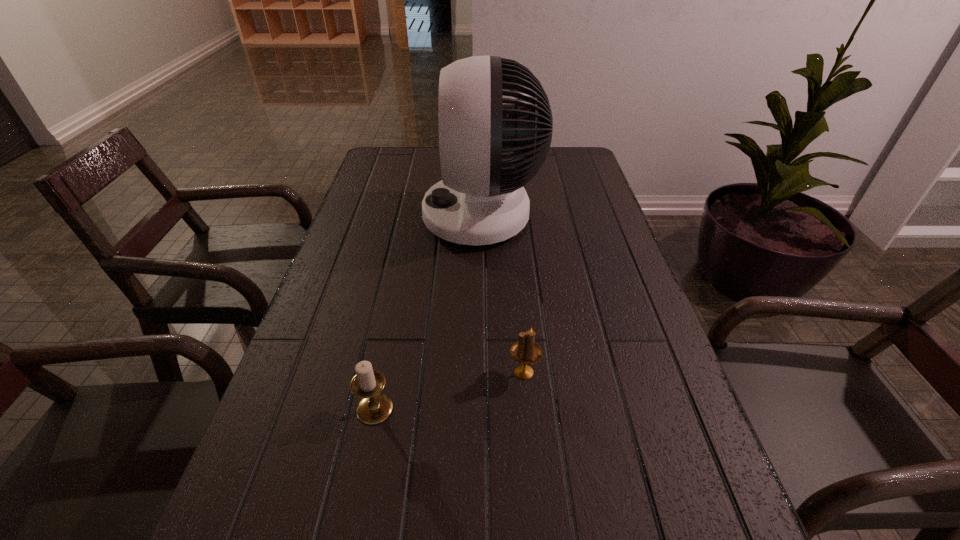
I want to click on free point located on the front of the nearer candle holder, so click(x=350, y=528).

Locate an element on the screen. object that is at the left edge is located at coordinates (374, 407).

Locate an element on the screen. The width and height of the screenshot is (960, 540). vacant region at the far edge of the desktop is located at coordinates (434, 148).

Locate an element on the screen. vacant area at the left edge is located at coordinates (400, 186).

In the image, there is a desktop. Where is `vacant area at the right edge`? vacant area at the right edge is located at coordinates (588, 226).

Find the location of a particular element. free space at the far left corner of the desktop is located at coordinates (372, 162).

Locate an element on the screen. The image size is (960, 540). free point between the nearer candle holder and the farther candle holder is located at coordinates (449, 390).

This screenshot has width=960, height=540. What are the coordinates of `free spot between the nearest object and the farthest object` in the screenshot? It's located at (428, 313).

At what (x,y) coordinates should I click in order to perform the action: click on vacant space that's between the tallest object and the second nearest object. Please return your answer as a coordinate pair (x, y). Image resolution: width=960 pixels, height=540 pixels. Looking at the image, I should click on (503, 295).

Identify the location of vacant area between the nearest object and the second farthest object. The height and width of the screenshot is (540, 960). (449, 390).